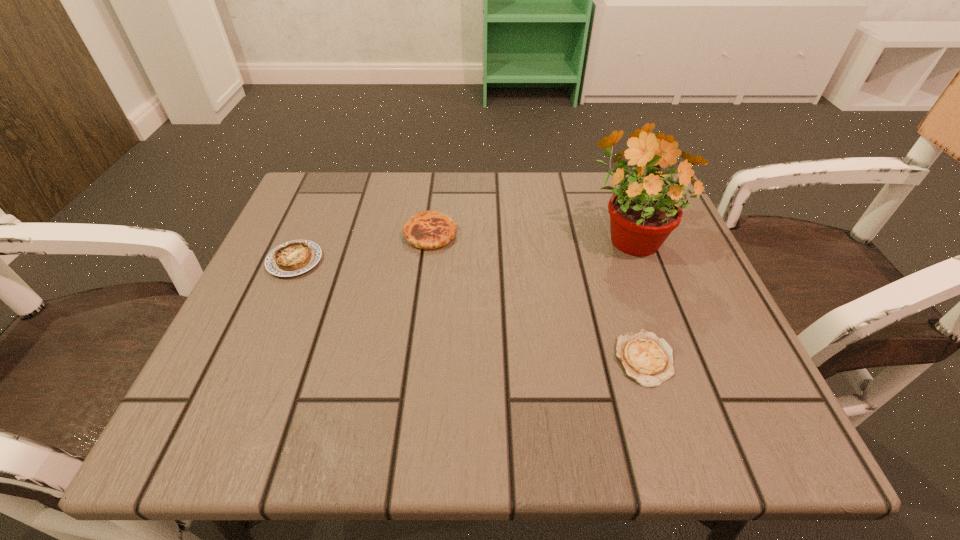
Locate an element on the screen. This screenshot has width=960, height=540. vacant space located 0.130m on the back of the rightmost quiche is located at coordinates (619, 280).

Locate an element on the screen. The image size is (960, 540). flowerpot that is at the far edge is located at coordinates (643, 213).

At what (x,y) coordinates should I click in order to perform the action: click on quiche located at the far edge. Please return your answer as a coordinate pair (x, y). The image size is (960, 540). Looking at the image, I should click on (426, 230).

What are the coordinates of `object situated at the left edge` in the screenshot? It's located at (292, 258).

Image resolution: width=960 pixels, height=540 pixels. In order to click on flowerpot that is at the right edge in this screenshot , I will do pyautogui.click(x=643, y=213).

At what (x,y) coordinates should I click in order to perform the action: click on quiche that is at the right edge. Please return your answer as a coordinate pair (x, y). The image size is (960, 540). Looking at the image, I should click on (645, 358).

You are a GUI agent. You are given a task and a screenshot of the screen. Output one action in this format:
    pyautogui.click(x=<x>, y=<y>)
    Task: Click on the object at the far right corner
    The height and width of the screenshot is (540, 960).
    Given the screenshot: What is the action you would take?
    pyautogui.click(x=643, y=213)

I want to click on free space at the far edge of the desktop, so click(x=509, y=173).

The width and height of the screenshot is (960, 540). In the image, there is a desktop. Identify the location of vacant space at the left edge. (277, 319).

You are a GUI agent. You are given a task and a screenshot of the screen. Output one action in this format:
    pyautogui.click(x=<x>, y=<y>)
    Task: Click on the free space at the right edge of the desktop
    This screenshot has width=960, height=540.
    Given the screenshot: What is the action you would take?
    pyautogui.click(x=757, y=389)